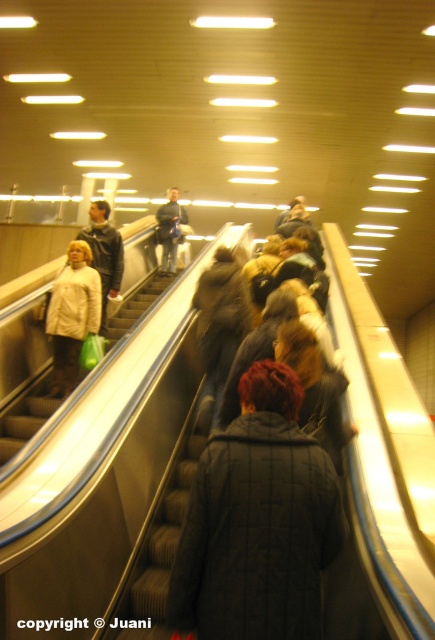
You are a person standing at the bottom of the escalator. You see a beige quilted coat at center and a matte black jacket at left. Which person is closer to you?

The beige quilted coat at center is below matte black jacket at left, so the person wearing the beige quilted coat at center is closer to you.

You are a person standing at the bottom of the escalator and you see two coats on the steps ahead of you. The beige quilted coat at center and the dark gray jacket at center. Which coat will reach the bottom first?

The beige quilted coat at center will reach the bottom first because it is shorter than the dark gray jacket at center, so it will come down the escalator sooner.

You are a person standing at the bottom of the escalator in the subway station. You want to go to the beige quilted coat at center. Which direction should you move to reach it?

The beige quilted coat at center is located at point (72,314), so you should move towards the center of the escalator to reach it.